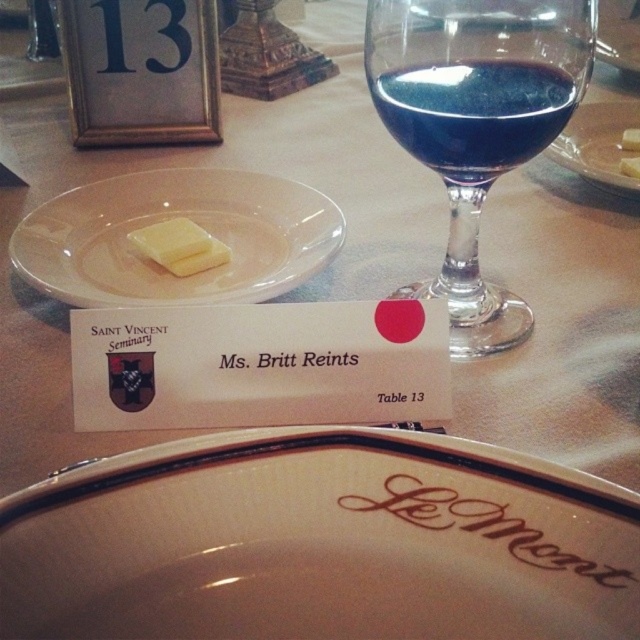
Question: Estimate the real-world distances between objects in this image. Which object is closer to the clear glass plate at center?

Choices:
 (A) yellow creamy butter at center
 (B) yellow butter at center
 (C) blue glass wine at upper center
 (D) white glass plate at upper left

Answer: (B)

Question: Is the position of white glossy platter at center less distant than that of yellow butter at upper left?

Choices:
 (A) yes
 (B) no

Answer: (A)

Question: Which object is positioned closest to the clear glass plate at center?

Choices:
 (A) yellow butter at center
 (B) white glossy platter at center

Answer: (A)

Question: Based on their relative distances, which object is nearer to the yellow butter at upper left?

Choices:
 (A) white glossy platter at center
 (B) blue glass wine at upper center

Answer: (B)

Question: Does white glass plate at upper left appear on the left side of blue glass wine at upper center?

Choices:
 (A) yes
 (B) no

Answer: (A)

Question: Can you confirm if white glass plate at upper left is positioned above clear glass plate at center?

Choices:
 (A) no
 (B) yes

Answer: (A)